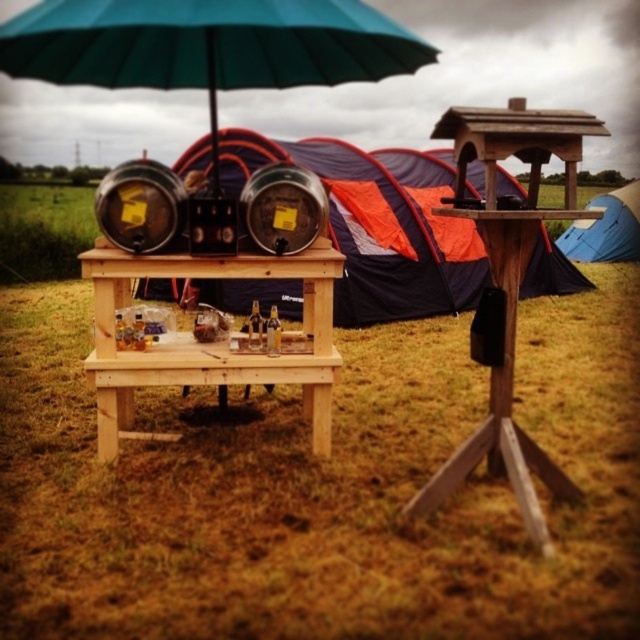
Question: Which point is closer to the camera taking this photo?

Choices:
 (A) (344, 144)
 (B) (611, 260)

Answer: (A)

Question: Among these points, which one is farthest from the camera?

Choices:
 (A) (376, 152)
 (B) (248, 374)
 (C) (90, 38)

Answer: (A)

Question: In this image, where is green fabric umbrella at upper center located relative to orange fabric tent at center?

Choices:
 (A) right
 (B) left

Answer: (B)

Question: Does green fabric umbrella at upper center appear on the right side of orange fabric tent at center?

Choices:
 (A) yes
 (B) no

Answer: (B)

Question: Can you confirm if orange fabric tent at center is wider than light brown wood picnic table at center?

Choices:
 (A) yes
 (B) no

Answer: (A)

Question: Which is farther from the green fabric umbrella at upper center?

Choices:
 (A) orange fabric tent at center
 (B) blue fabric tent at right

Answer: (B)